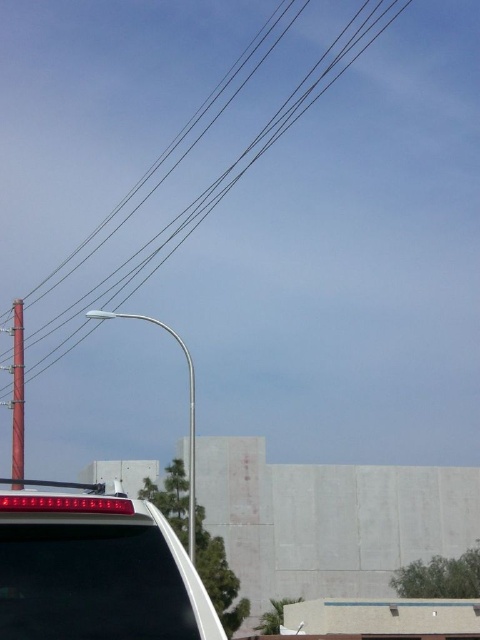
You are standing on the street looking at the scene. There are two points marked in the image. The first point is at coordinate point (4, 588) and the second point is at coordinate point (117, 301). Which of these two points is closer to you?

Point (4, 588) is closer to the viewer than point (117, 301).

You are standing at the point marked by the coordinates point (215,184). Looking around, you see the black wire at upper left. Which direction should you walk to reach the streetlight on the left side of the image?

The point (215,184) marks the black wire at upper left. Since the streetlight is on the left side of the image, you should walk towards the left to reach it.